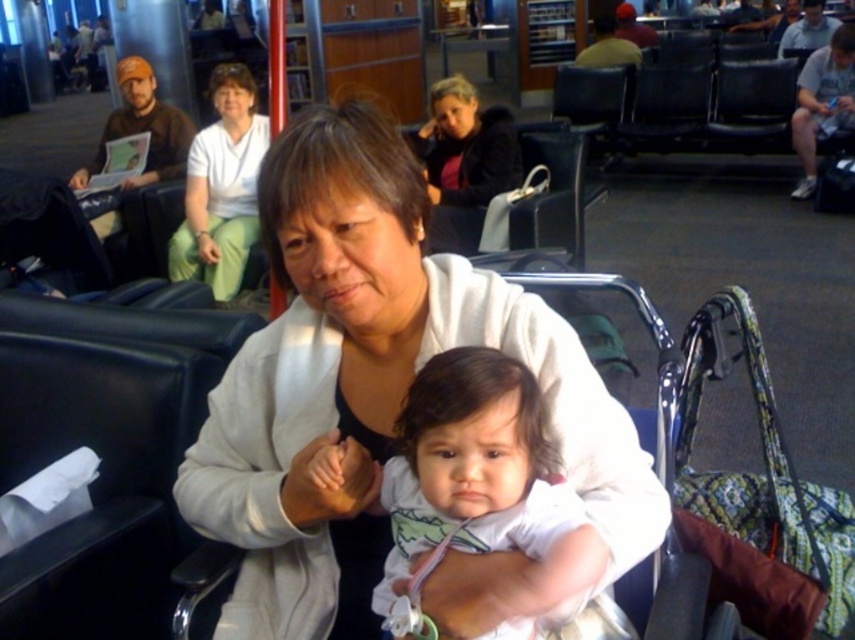
You are an airport security officer and you need to check the items on the person wearing the white soft jacket at center and the white fabric shirt at upper center. Which piece of clothing is on the right side when viewed from the front?

The white soft jacket at center is positioned on the right side of the white fabric shirt at upper center, so the white soft jacket at center is on the right.

You are an airport staff member who needs to determine which jacket is shorter between the white soft jacket at center and the matte black jacket at upper center. Based on the scene, which one should you choose?

The white soft jacket at center is shorter than the matte black jacket at upper center, so you should choose the white soft jacket at center.